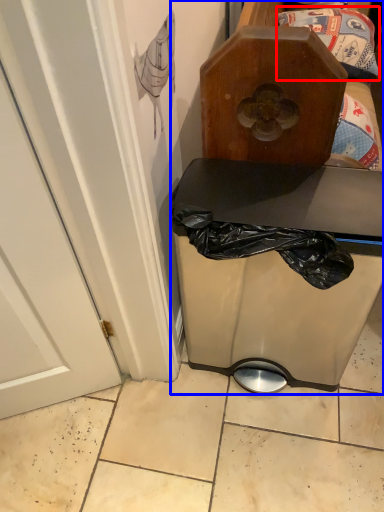
Question: Which object is closer to the camera taking this photo, waste (highlighted by a red box) or furniture (highlighted by a blue box)?

Choices:
 (A) waste
 (B) furniture

Answer: (B)